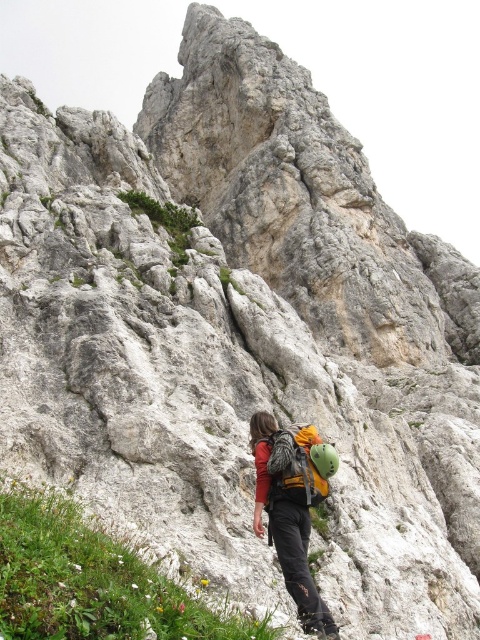
You are a hiker planning to move from the green grass at lower left to the matte black backpack at center. Considering the rugged terrain, what is the shortest path distance you need to cover?

The shortest path distance between the green grass at lower left and the matte black backpack at center is 8.76 meters.

You are planning to hike up the mountain and see two backpacks, the matte black backpack at center and the matte green backpack at center. Which one can carry more items?

The matte black backpack at center is larger in size than the matte green backpack at center, so it can carry more items.